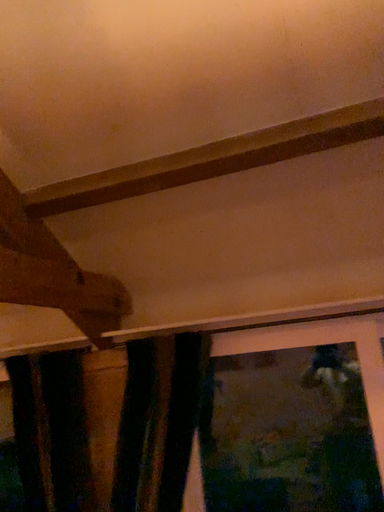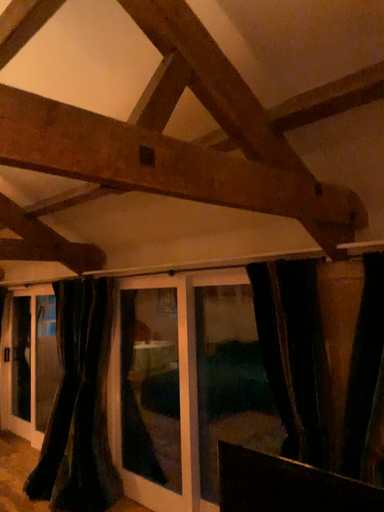
Question: How did the camera likely rotate when shooting the video?

Choices:
 (A) rotated right
 (B) rotated left

Answer: (B)